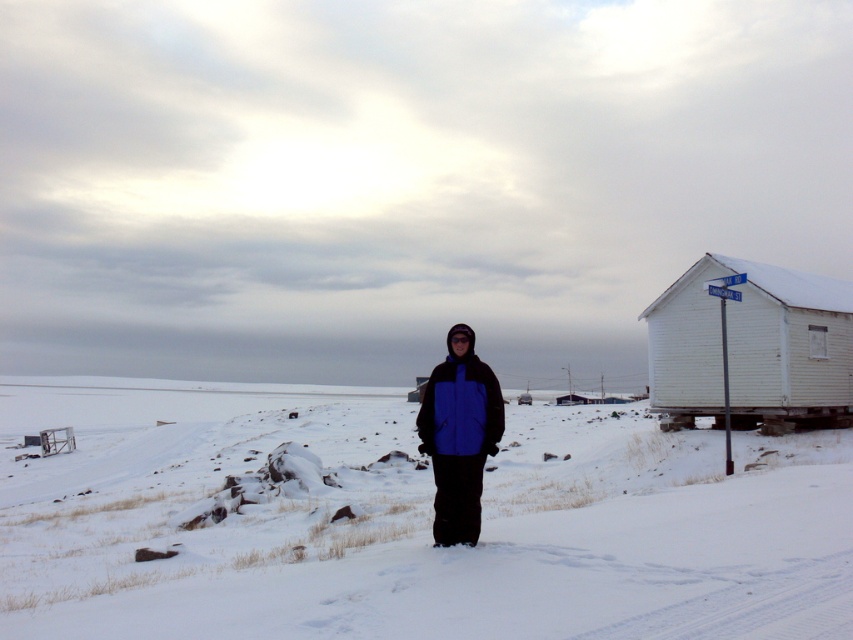
Can you confirm if white fluffy snow at center is taller than blue matte jacket at center?

Yes, white fluffy snow at center is taller than blue matte jacket at center.

Looking at this image, which is more to the left, white fluffy snow at center or blue matte jacket at center?

From the viewer's perspective, white fluffy snow at center appears more on the left side.

Which is behind, point (167, 593) or point (440, 419)?

The point (440, 419) is behind.

Where is `white fluffy snow at center`? white fluffy snow at center is located at coordinates (405, 520).

From the picture: Does white wooden hut at right appear on the right side of blue matte jacket at center?

Correct, you'll find white wooden hut at right to the right of blue matte jacket at center.

Who is positioned more to the left, white wooden hut at right or blue matte jacket at center?

blue matte jacket at center is more to the left.

Where is `white wooden hut at right`? Image resolution: width=853 pixels, height=640 pixels. white wooden hut at right is located at coordinates (752, 348).

Identify the location of white wooden hut at right. (752, 348).

Between point (811, 525) and point (792, 291), which one is positioned behind?

Point (792, 291)

Which is in front, point (201, 410) or point (786, 284)?

Point (786, 284) is in front.

Who is more distant from viewer, (788, 500) or (827, 307)?

The point (827, 307) is behind.

Identify the location of white fluffy snow at center. (405, 520).